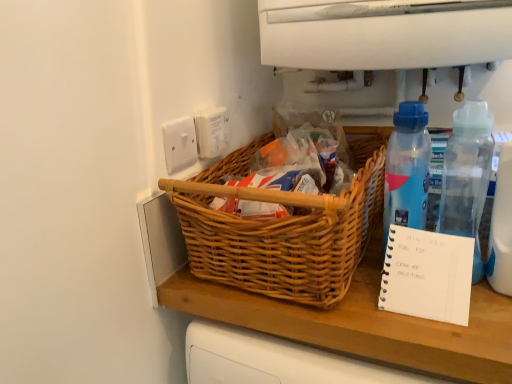
Question: From the image's perspective, does blue translucent bottle at right, which is the second bottle from right to left, appear lower than white spiral notebook at right?

Choices:
 (A) yes
 (B) no

Answer: (B)

Question: Is blue translucent bottle at right, placed as the first bottle when sorted from left to right, turned away from white spiral notebook at right?

Choices:
 (A) no
 (B) yes

Answer: (A)

Question: Is blue translucent bottle at right, placed as the first bottle when sorted from left to right, behind white spiral notebook at right?

Choices:
 (A) yes
 (B) no

Answer: (A)

Question: Can you confirm if blue translucent bottle at right, which is the second bottle from right to left, is wider than white spiral notebook at right?

Choices:
 (A) yes
 (B) no

Answer: (B)

Question: Can you confirm if blue translucent bottle at right, which is the second bottle from right to left, is positioned to the right of white spiral notebook at right?

Choices:
 (A) yes
 (B) no

Answer: (B)

Question: From the image's perspective, is blue translucent bottle at right, which is the second bottle from right to left, over white spiral notebook at right?

Choices:
 (A) yes
 (B) no

Answer: (A)

Question: Is transparent plastic bottle at right, arranged as the second bottle when viewed from the left, looking in the opposite direction of white spiral notebook at right?

Choices:
 (A) no
 (B) yes

Answer: (A)

Question: Is transparent plastic bottle at right, arranged as the second bottle when viewed from the left, outside white spiral notebook at right?

Choices:
 (A) no
 (B) yes

Answer: (B)

Question: Is white spiral notebook at right inside transparent plastic bottle at right, positioned as the 1th bottle in right-to-left order?

Choices:
 (A) no
 (B) yes

Answer: (A)

Question: Is transparent plastic bottle at right, arranged as the second bottle when viewed from the left, in contact with white spiral notebook at right?

Choices:
 (A) no
 (B) yes

Answer: (A)

Question: From a real-world perspective, is transparent plastic bottle at right, arranged as the second bottle when viewed from the left, below white spiral notebook at right?

Choices:
 (A) yes
 (B) no

Answer: (B)

Question: Considering the relative sizes of transparent plastic bottle at right, arranged as the second bottle when viewed from the left, and white spiral notebook at right in the image provided, is transparent plastic bottle at right, arranged as the second bottle when viewed from the left, shorter than white spiral notebook at right?

Choices:
 (A) no
 (B) yes

Answer: (A)

Question: Is the surface of white plastic electric outlet at upper center, marked as the 1th electric outlet in a right-to-left arrangement, in direct contact with blue translucent bottle at right, which is the second bottle from right to left?

Choices:
 (A) yes
 (B) no

Answer: (B)